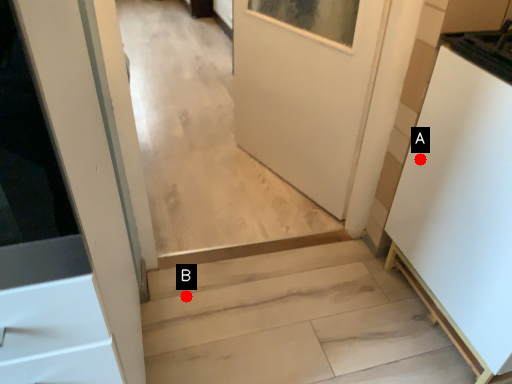
Question: Two points are circled on the image, labeled by A and B beside each circle. Which point is closer to the camera?

Choices:
 (A) A is closer
 (B) B is closer

Answer: (A)